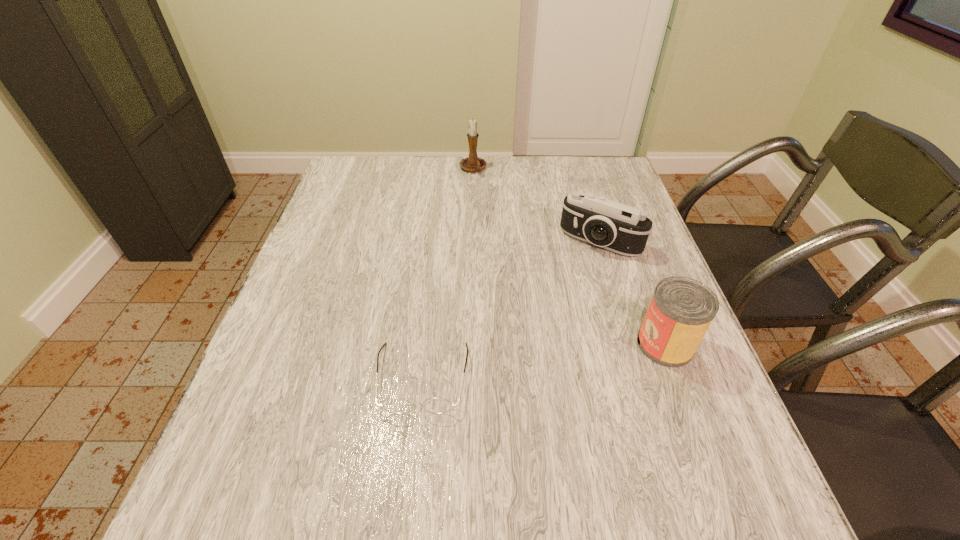
I want to click on spectacles, so click(x=436, y=405).

Locate an element on the screen. The height and width of the screenshot is (540, 960). can is located at coordinates (681, 310).

You are a GUI agent. You are given a task and a screenshot of the screen. Output one action in this format:
    pyautogui.click(x=<x>, y=<y>)
    Task: Click on the candle holder
    The image size is (960, 540).
    Given the screenshot: What is the action you would take?
    pyautogui.click(x=473, y=163)

The width and height of the screenshot is (960, 540). I want to click on the second farthest object, so click(623, 229).

Where is `vacant space positioned 0.070m through the lenses of the spectacles`? vacant space positioned 0.070m through the lenses of the spectacles is located at coordinates (415, 453).

This screenshot has height=540, width=960. I want to click on blank space located on the back of the can, so click(x=620, y=224).

You are a GUI agent. You are given a task and a screenshot of the screen. Output one action in this format:
    pyautogui.click(x=<x>, y=<y>)
    Task: Click on the vacant region located on the side of the candle holder with the handle
    The height and width of the screenshot is (540, 960).
    Given the screenshot: What is the action you would take?
    pyautogui.click(x=482, y=202)

Locate an element on the screen. The width and height of the screenshot is (960, 540). free space located on the side of the candle holder with the handle is located at coordinates (490, 227).

Image resolution: width=960 pixels, height=540 pixels. What are the coordinates of `free space located on the side of the candle holder with the handle` in the screenshot? It's located at (488, 222).

Identify the location of vacant region located on the front lens of the third nearest object. (553, 301).